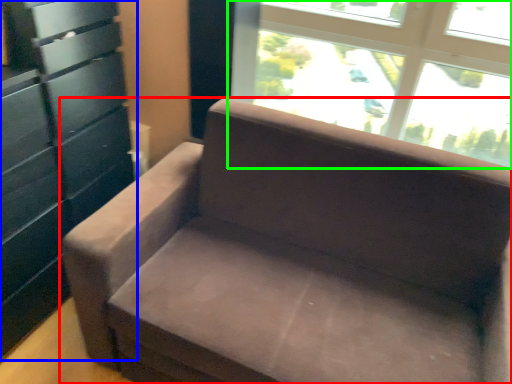
Question: Based on their relative distances, which object is nearer to studio couch (highlighted by a red box)? Choose from dresser (highlighted by a blue box) and window (highlighted by a green box).

Choices:
 (A) dresser
 (B) window

Answer: (A)